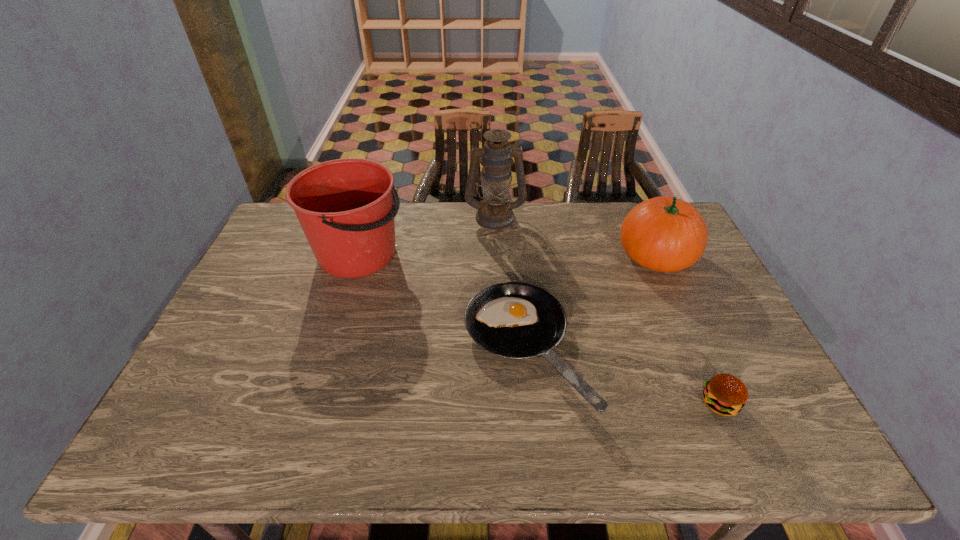
This screenshot has height=540, width=960. I want to click on oil lamp, so click(x=495, y=212).

Where is `bucket`? This screenshot has width=960, height=540. bucket is located at coordinates (345, 207).

Where is `the leftmost object`? The image size is (960, 540). the leftmost object is located at coordinates (345, 207).

At what (x,y) coordinates should I click in order to perform the action: click on the third tallest object. Please return your answer as a coordinate pair (x, y). This screenshot has width=960, height=540. Looking at the image, I should click on (666, 234).

You are a GUI agent. You are given a task and a screenshot of the screen. Output one action in this format:
    pyautogui.click(x=<x>, y=<y>)
    Task: Click on the second shortest object
    This screenshot has width=960, height=540.
    Given the screenshot: What is the action you would take?
    pyautogui.click(x=725, y=395)

This screenshot has width=960, height=540. Find the location of `the shortest object`. the shortest object is located at coordinates (515, 320).

The image size is (960, 540). In order to click on free location located 0.140m on the front of the tallest object in this screenshot , I will do `click(496, 256)`.

I want to click on free spot located 0.290m on the right of the bucket, so click(x=494, y=254).

Identify the location of free region located on the front of the third shortest object. The image size is (960, 540). (698, 348).

Locate an element on the screen. The height and width of the screenshot is (540, 960). vacant point located on the back of the second shortest object is located at coordinates (681, 316).